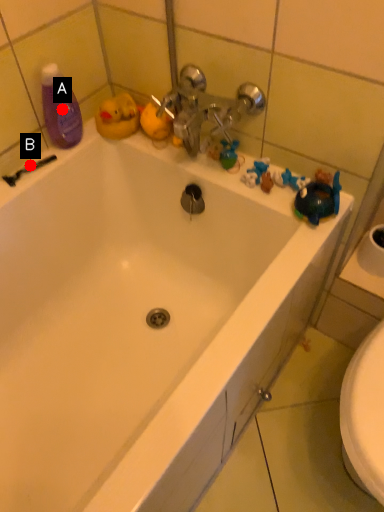
Question: Two points are circled on the image, labeled by A and B beside each circle. Which point is farther to the camera?

Choices:
 (A) A is further
 (B) B is further

Answer: (B)